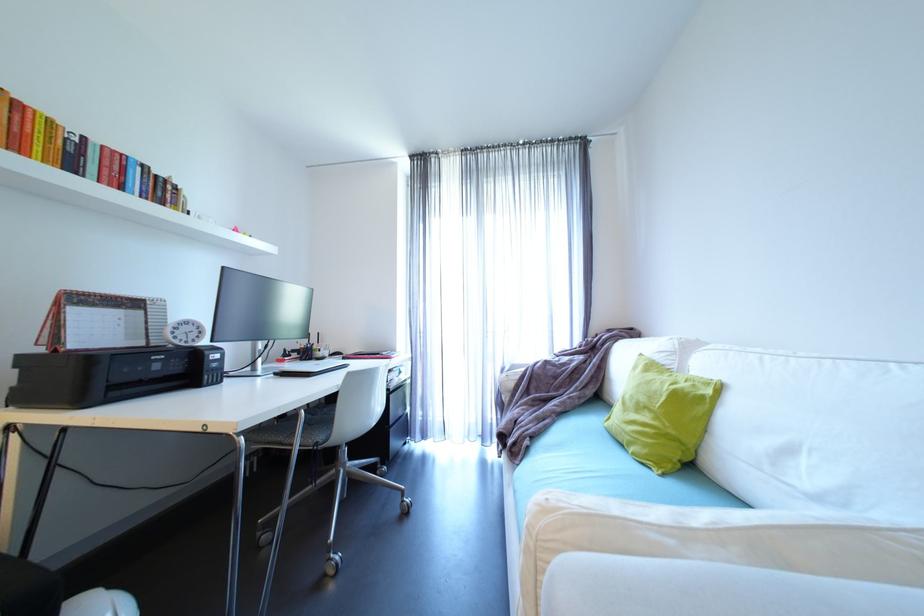
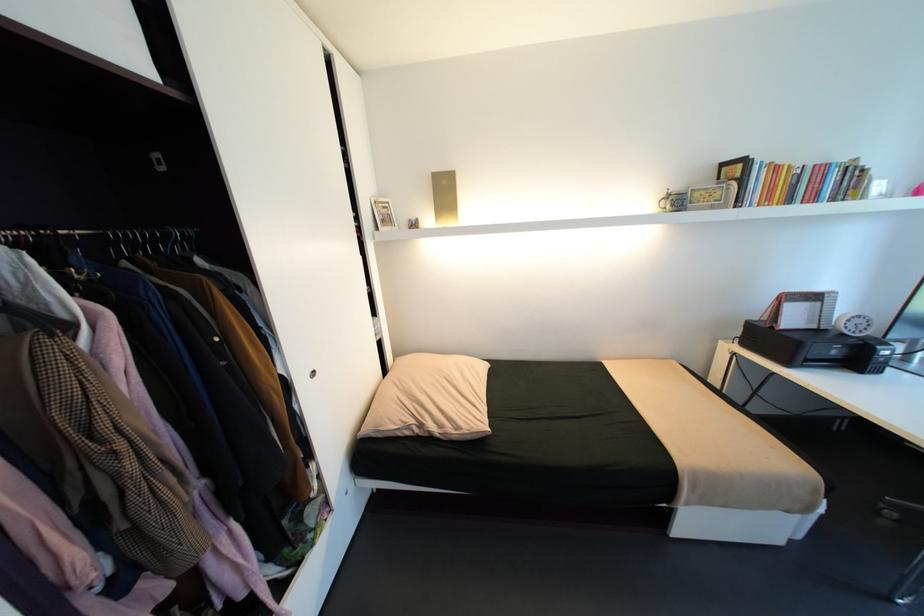
Where in the second image is the point corresponding to [64,351] from the first image?

(779, 328)